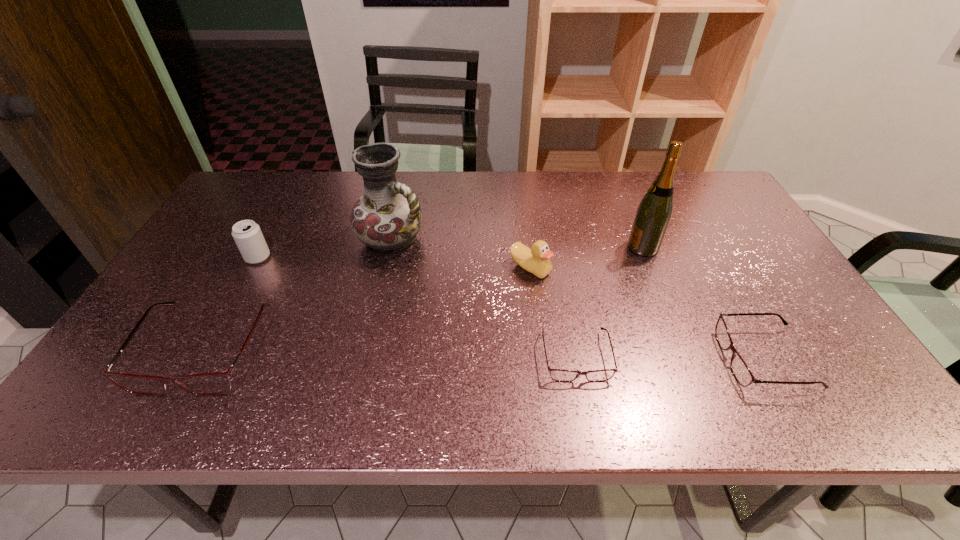
Locate an element on the screen. spectacles that can be found as the closest to the second shortest object is located at coordinates (560, 375).

Locate which spectacles ranks third in proximity to the fifth object from right to left. Please provide its 2D coordinates. Your answer should be formatted as a tuple, i.e. [(x, y)], where the tuple contains the x and y coordinates of a point satisfying the conditions above.

[(740, 370)]